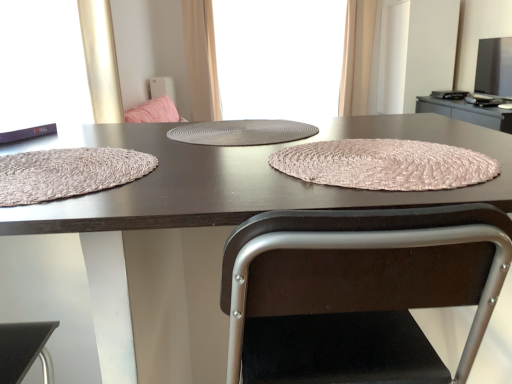
Describe the element at coordinates (201, 59) in the screenshot. I see `beige fabric curtain at upper center, marked as the second curtain in a right-to-left arrangement` at that location.

Measure the distance between point (x=184, y=352) and camera.

The depth of point (x=184, y=352) is 1.17 meters.

Locate an element on the screen. pink woven placemat at center, which appears as the second blanket when viewed from the left is located at coordinates (385, 165).

Looking at the image, does matte black book at left, arranged as the first window screen when viewed from the front, seem bigger or smaller compared to gray woven placemat at center, the 1th window screen from the right?

Considering their sizes, matte black book at left, arranged as the first window screen when viewed from the front, takes up less space than gray woven placemat at center, the 1th window screen from the right.

From a real-world perspective, is matte black book at left, marked as the first window screen in a left-to-right arrangement, physically below gray woven placemat at center, the second window screen when ordered from bottom to top?

No, from a real-world perspective, matte black book at left, marked as the first window screen in a left-to-right arrangement, is not under gray woven placemat at center, the second window screen when ordered from bottom to top.

Identify the location of window screen on the left of gray woven placemat at center, the second window screen from the front. The width and height of the screenshot is (512, 384). (42, 65).

How many degrees apart are the facing directions of matte black book at left, the 2th window screen from the top, and gray woven placemat at center, the second window screen from the front?

The angular difference between matte black book at left, the 2th window screen from the top, and gray woven placemat at center, the second window screen from the front, is 90.3 degrees.

Does point (373, 21) appear closer or farther from the camera than point (12, 93)?

Point (373, 21).

Could matte black book at left, the 2th window screen from the top, be considered to be inside beige fabric curtain at upper right, which is the 2th curtain from left to right?

No, matte black book at left, the 2th window screen from the top, is located outside of beige fabric curtain at upper right, which is the 2th curtain from left to right.

From the image's perspective, which one is positioned lower, beige fabric curtain at upper right, the first curtain when ordered from right to left, or matte black book at left, marked as the first window screen in a left-to-right arrangement?

matte black book at left, marked as the first window screen in a left-to-right arrangement, is shown below in the image.

From a real-world perspective, is beige fabric curtain at upper center, positioned as the 1th curtain in left-to-right order, physically located above or below beige fabric curtain at upper right, which is the 2th curtain from left to right?

In terms of real-world spatial position, beige fabric curtain at upper center, positioned as the 1th curtain in left-to-right order, is above beige fabric curtain at upper right, which is the 2th curtain from left to right.

Which object is thinner, beige fabric curtain at upper center, positioned as the 1th curtain in left-to-right order, or beige fabric curtain at upper right, which is the 2th curtain from left to right?

beige fabric curtain at upper center, positioned as the 1th curtain in left-to-right order, is thinner.

How many degrees apart are the facing directions of gray woven placemat at center, the 1th window screen from the right, and beige fabric curtain at upper right, the first curtain when ordered from right to left?

0.000116 degrees.

Is the depth of gray woven placemat at center, placed as the 1th window screen when sorted from top to bottom, greater than that of beige fabric curtain at upper right, the first curtain when ordered from right to left?

Yes, gray woven placemat at center, placed as the 1th window screen when sorted from top to bottom, is behind beige fabric curtain at upper right, the first curtain when ordered from right to left.

Considering the positions of point (257, 9) and point (349, 89), is point (257, 9) closer or farther from the camera than point (349, 89)?

Point (257, 9).

Is the surface of gray woven placemat at center, placed as the 1th window screen when sorted from top to bottom, in direct contact with beige fabric curtain at upper right, the first curtain when ordered from right to left?

gray woven placemat at center, placed as the 1th window screen when sorted from top to bottom, is not next to beige fabric curtain at upper right, the first curtain when ordered from right to left, and they're not touching.

Is point (320, 189) positioned in front of point (116, 178)?

Yes, it is.

Is matte brown placemat at center not inside rustic woven placemat at left, the 2th blanket positioned from the right?

Yes, matte brown placemat at center is not within rustic woven placemat at left, the 2th blanket positioned from the right.

From a real-world perspective, is matte brown placemat at center under rustic woven placemat at left, the first blanket positioned from the left?

Yes.

From the image's perspective, is matte brown placemat at center beneath rustic woven placemat at left, the first blanket positioned from the left?

Indeed, from the image's perspective, matte brown placemat at center is shown beneath rustic woven placemat at left, the first blanket positioned from the left.

Considering the positions of points (122, 164) and (332, 166), is point (122, 164) closer to camera compared to point (332, 166)?

No, (122, 164) is further to viewer.

Which object is further away from the camera, rustic woven placemat at left, the first blanket positioned from the left, or pink woven placemat at center, which appears as the second blanket when viewed from the left?

Positioned behind is pink woven placemat at center, which appears as the second blanket when viewed from the left.

Considering the positions of objects rustic woven placemat at left, the 2th blanket positioned from the right, and pink woven placemat at center, which appears as the second blanket when viewed from the left, in the image provided, who is more to the right, rustic woven placemat at left, the 2th blanket positioned from the right, or pink woven placemat at center, which appears as the second blanket when viewed from the left,?

Positioned to the right is pink woven placemat at center, which appears as the second blanket when viewed from the left.

Is rustic woven placemat at left, the first blanket positioned from the left, surrounding pink woven placemat at center, the 1th blanket from the right?

No.

Where is `the 1st blanket to the right of the beige fabric curtain at upper center, positioned as the 1th curtain in left-to-right order, counting from the anchor's position`? the 1st blanket to the right of the beige fabric curtain at upper center, positioned as the 1th curtain in left-to-right order, counting from the anchor's position is located at coordinates (68, 173).

Looking at this image, is beige fabric curtain at upper center, marked as the second curtain in a right-to-left arrangement, turned away from rustic woven placemat at left, the first blanket positioned from the left?

beige fabric curtain at upper center, marked as the second curtain in a right-to-left arrangement, is not turned away from rustic woven placemat at left, the first blanket positioned from the left.

This screenshot has width=512, height=384. I want to click on window screen below the gray woven placemat at center, the second window screen from the front (from the image's perspective), so click(x=42, y=65).

Where is `curtain that is the 1st one when counting upward from the matte black book at left, marked as the 2th window screen in a back-to-front arrangement (from the image's perspective)`? The height and width of the screenshot is (384, 512). curtain that is the 1st one when counting upward from the matte black book at left, marked as the 2th window screen in a back-to-front arrangement (from the image's perspective) is located at coordinates click(x=357, y=57).

Considering their positions, is matte black book at left, which appears as the first window screen when ordered from the bottom, positioned further to beige fabric curtain at upper center, marked as the second curtain in a right-to-left arrangement, than gray textured placemat at center?

The object further to beige fabric curtain at upper center, marked as the second curtain in a right-to-left arrangement, is gray textured placemat at center.

Looking at this image, looking at the image, which one is located further to pink woven placemat at center, which appears as the second blanket when viewed from the left, rustic woven placemat at left, the first blanket positioned from the left, or matte black book at left, the 2th window screen from the right?

matte black book at left, the 2th window screen from the right, is further to pink woven placemat at center, which appears as the second blanket when viewed from the left.

Which object lies further to the anchor point rustic woven placemat at left, the first blanket positioned from the left, beige fabric curtain at upper center, positioned as the 1th curtain in left-to-right order, or pink woven placemat at center, which appears as the second blanket when viewed from the left?

The object further to rustic woven placemat at left, the first blanket positioned from the left, is beige fabric curtain at upper center, positioned as the 1th curtain in left-to-right order.

Consider the image. Considering their positions, is beige fabric curtain at upper right, the first curtain when ordered from right to left, positioned closer to pink woven placemat at center, which appears as the second blanket when viewed from the left, than matte black book at left, marked as the first window screen in a left-to-right arrangement?

matte black book at left, marked as the first window screen in a left-to-right arrangement.

Estimate the real-world distances between objects in this image. Which object is closer to pink woven placemat at center, the 1th blanket from the right, gray textured placemat at center or gray woven placemat at center, which appears as the first window screen when viewed from the back?

Among the two, gray textured placemat at center is located nearer to pink woven placemat at center, the 1th blanket from the right.

Looking at the image, which one is located closer to pink woven placemat at center, which appears as the second blanket when viewed from the left, gray woven placemat at center, the 1th window screen from the right, or beige fabric curtain at upper center, marked as the second curtain in a right-to-left arrangement?

gray woven placemat at center, the 1th window screen from the right, lies closer to pink woven placemat at center, which appears as the second blanket when viewed from the left, than the other object.

Considering their positions, is gray textured placemat at center positioned further to beige fabric curtain at upper center, marked as the second curtain in a right-to-left arrangement, than matte brown placemat at center?

The object further to beige fabric curtain at upper center, marked as the second curtain in a right-to-left arrangement, is matte brown placemat at center.

Estimate the real-world distances between objects in this image. Which object is further from beige fabric curtain at upper right, the first curtain when ordered from right to left, pink woven placemat at center, the 1th blanket from the right, or matte brown placemat at center?

Based on the image, pink woven placemat at center, the 1th blanket from the right, appears to be further to beige fabric curtain at upper right, the first curtain when ordered from right to left.

Locate an element on the screen. The height and width of the screenshot is (384, 512). window screen located between rustic woven placemat at left, the first blanket positioned from the left, and beige fabric curtain at upper center, marked as the second curtain in a right-to-left arrangement, in the depth direction is located at coordinates (42, 65).

This screenshot has width=512, height=384. Find the location of `paper plate between matte brown placemat at center and gray woven placemat at center, the 1th window screen from the right, along the z-axis`. paper plate between matte brown placemat at center and gray woven placemat at center, the 1th window screen from the right, along the z-axis is located at coordinates (242, 132).

Identify the location of paper plate between rustic woven placemat at left, the 2th blanket positioned from the right, and pink woven placemat at center, the 1th blanket from the right. (242, 132).

The height and width of the screenshot is (384, 512). In order to click on paper plate located between pink woven placemat at center, which appears as the second blanket when viewed from the left, and beige fabric curtain at upper right, the first curtain when ordered from right to left, in the depth direction in this screenshot , I will do `click(242, 132)`.